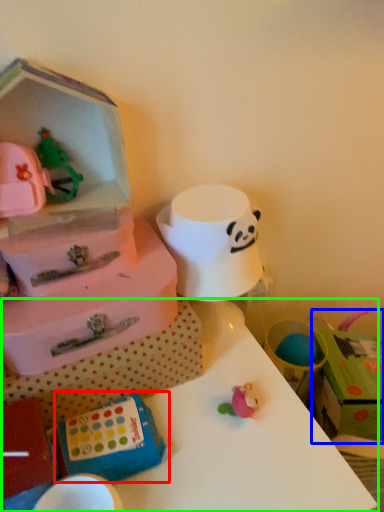
Question: Considering the real-world distances, which object is farthest from box (highlighted by a red box)? storage box (highlighted by a blue box) or table (highlighted by a green box)?

Choices:
 (A) storage box
 (B) table

Answer: (A)